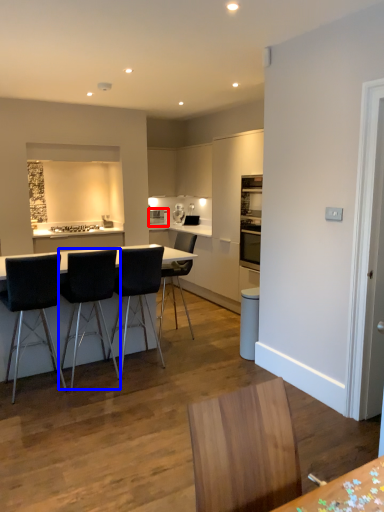
Question: Which object appears farthest to the camera in this image, appliance (highlighted by a red box) or chair (highlighted by a blue box)?

Choices:
 (A) appliance
 (B) chair

Answer: (A)